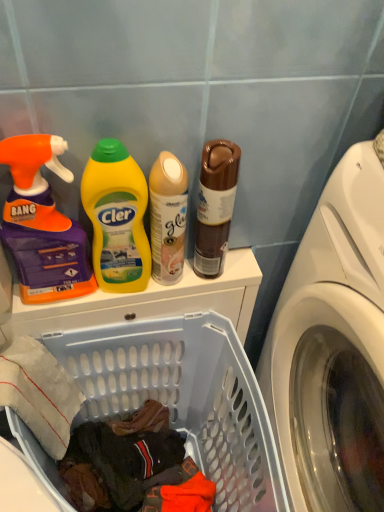
What do you see at coordinates (184, 396) in the screenshot?
I see `translucent plastic laundry basket at lower left` at bounding box center [184, 396].

This screenshot has width=384, height=512. Describe the element at coordinates (168, 217) in the screenshot. I see `matte beige spray can at center, placed as the 3th cleaning product when sorted from left to right` at that location.

Describe the element at coordinates (333, 347) in the screenshot. I see `white glossy washing machine at right` at that location.

Where is `white glossy washing machine at right`? This screenshot has width=384, height=512. white glossy washing machine at right is located at coordinates (333, 347).

How much space does orange matte spray bottle at left, the first cleaning product in the left-to-right sequence, occupy vertically?

It is 10.46 inches.

Where is `orange matte spray bottle at left, the first cleaning product in the left-to-right sequence`? Image resolution: width=384 pixels, height=512 pixels. orange matte spray bottle at left, the first cleaning product in the left-to-right sequence is located at coordinates 42,224.

In order to face yellow plastic bottle at center, acting as the 2th cleaning product starting from the right, should I rotate leftwards or rightwards?

Rotate left and turn 10.042 degrees.

Identify the location of yellow plastic bottle at center, which appears as the 2th cleaning product when viewed from the left. (117, 217).

Locate an element on the screen. translucent plastic laundry basket at lower left is located at coordinates (184, 396).

Is orange matte spray bottle at left, the 3th cleaning product viewed from the right, spatially inside matte beige spray can at center, acting as the 1th cleaning product starting from the right, or outside of it?

orange matte spray bottle at left, the 3th cleaning product viewed from the right, lies outside matte beige spray can at center, acting as the 1th cleaning product starting from the right.

From the image's perspective, is orange matte spray bottle at left, the 3th cleaning product viewed from the right, under matte beige spray can at center, placed as the 3th cleaning product when sorted from left to right?

Correct, orange matte spray bottle at left, the 3th cleaning product viewed from the right, appears lower than matte beige spray can at center, placed as the 3th cleaning product when sorted from left to right, in the image.

From a real-world perspective, is orange matte spray bottle at left, the 3th cleaning product viewed from the right, physically above matte beige spray can at center, placed as the 3th cleaning product when sorted from left to right?

Yes, from a real-world perspective, orange matte spray bottle at left, the 3th cleaning product viewed from the right, is above matte beige spray can at center, placed as the 3th cleaning product when sorted from left to right.

Is orange matte spray bottle at left, the 3th cleaning product viewed from the right, touching matte beige spray can at center, placed as the 3th cleaning product when sorted from left to right?

No, orange matte spray bottle at left, the 3th cleaning product viewed from the right, is not in contact with matte beige spray can at center, placed as the 3th cleaning product when sorted from left to right.

How distant is yellow plastic bottle at center, which appears as the 2th cleaning product when viewed from the left, from matte beige spray can at center, placed as the 3th cleaning product when sorted from left to right?

The distance of yellow plastic bottle at center, which appears as the 2th cleaning product when viewed from the left, from matte beige spray can at center, placed as the 3th cleaning product when sorted from left to right, is 1.91 inches.

Is yellow plastic bottle at center, acting as the 2th cleaning product starting from the right, inside the boundaries of matte beige spray can at center, placed as the 3th cleaning product when sorted from left to right, or outside?

yellow plastic bottle at center, acting as the 2th cleaning product starting from the right, is outside matte beige spray can at center, placed as the 3th cleaning product when sorted from left to right.

Considering the relative sizes of yellow plastic bottle at center, acting as the 2th cleaning product starting from the right, and matte beige spray can at center, acting as the 1th cleaning product starting from the right, in the image provided, is yellow plastic bottle at center, acting as the 2th cleaning product starting from the right, thinner than matte beige spray can at center, acting as the 1th cleaning product starting from the right,?

Yes.

Which of these two, yellow plastic bottle at center, which appears as the 2th cleaning product when viewed from the left, or matte beige spray can at center, acting as the 1th cleaning product starting from the right, stands shorter?

Standing shorter between the two is matte beige spray can at center, acting as the 1th cleaning product starting from the right.

Is matte beige spray can at center, acting as the 1th cleaning product starting from the right, oriented away from white glossy washing machine at right?

No, white glossy washing machine at right is not at the back of matte beige spray can at center, acting as the 1th cleaning product starting from the right.

Can you confirm if matte beige spray can at center, acting as the 1th cleaning product starting from the right, is thinner than white glossy washing machine at right?

Indeed, matte beige spray can at center, acting as the 1th cleaning product starting from the right, has a lesser width compared to white glossy washing machine at right.

In the image, is matte beige spray can at center, acting as the 1th cleaning product starting from the right, positioned in front of or behind white glossy washing machine at right?

matte beige spray can at center, acting as the 1th cleaning product starting from the right, is behind white glossy washing machine at right.

Can you tell me how much orange matte spray bottle at left, the first cleaning product in the left-to-right sequence, and brown matte can at upper center differ in facing direction?

They differ by 1.91 degrees in their facing directions.

Is orange matte spray bottle at left, the first cleaning product in the left-to-right sequence, spatially inside brown matte can at upper center, or outside of it?

orange matte spray bottle at left, the first cleaning product in the left-to-right sequence, exists outside the volume of brown matte can at upper center.

Is point (30, 135) positioned before point (203, 192)?

Yes, it is in front of point (203, 192).

From a real-world perspective, count 2nd cleaning products upward from the brown matte can at upper center and point to it. Please provide its 2D coordinates.

[(42, 224)]

What's the angular difference between translucent plastic laundry basket at lower left and white glossy washing machine at right's facing directions?

They differ by 86.3 degrees in their facing directions.

Looking at this image, can you confirm if translucent plastic laundry basket at lower left is shorter than white glossy washing machine at right?

Yes.

Looking at their sizes, would you say translucent plastic laundry basket at lower left is wider or thinner than white glossy washing machine at right?

In the image, translucent plastic laundry basket at lower left appears to be more narrow than white glossy washing machine at right.

Is translucent plastic laundry basket at lower left facing away from white glossy washing machine at right?

translucent plastic laundry basket at lower left does not have its back to white glossy washing machine at right.

The width and height of the screenshot is (384, 512). Find the location of `cleaning product that is the 1st object located behind the white glossy washing machine at right`. cleaning product that is the 1st object located behind the white glossy washing machine at right is located at coordinates (42, 224).

Relative to orange matte spray bottle at left, the first cleaning product in the left-to-right sequence, is white glossy washing machine at right in front or behind?

In the image, white glossy washing machine at right appears in front of orange matte spray bottle at left, the first cleaning product in the left-to-right sequence.

Is point (356, 422) more distant than point (16, 188)?

Yes, point (356, 422) is behind point (16, 188).

From a real-world perspective, is white glossy washing machine at right positioned over orange matte spray bottle at left, the first cleaning product in the left-to-right sequence, based on gravity?

No, from a real-world perspective, white glossy washing machine at right is not above orange matte spray bottle at left, the first cleaning product in the left-to-right sequence.

From a real-world perspective, is brown matte can at upper center physically below translucent plastic laundry basket at lower left?

No, from a real-world perspective, brown matte can at upper center is not below translucent plastic laundry basket at lower left.

Which is closer to the camera, (216, 205) or (135, 367)?

Positioned in front is point (216, 205).

Is the depth of brown matte can at upper center less than that of translucent plastic laundry basket at lower left?

No.

Would you consider brown matte can at upper center to be distant from translucent plastic laundry basket at lower left?

That's not correct — brown matte can at upper center is a little close to translucent plastic laundry basket at lower left.

Which cleaning product is the 2nd one when counting from the right side of the orange matte spray bottle at left, the 3th cleaning product viewed from the right? Please provide its 2D coordinates.

[(168, 217)]

The height and width of the screenshot is (512, 384). I want to click on the 1st cleaning product in front when counting from the matte beige spray can at center, acting as the 1th cleaning product starting from the right, so (x=117, y=217).

Looking at the image, which one is located closer to matte beige spray can at center, acting as the 1th cleaning product starting from the right, orange matte spray bottle at left, the 3th cleaning product viewed from the right, or brown matte can at upper center?

brown matte can at upper center lies closer to matte beige spray can at center, acting as the 1th cleaning product starting from the right, than the other object.

Considering their positions, is matte beige spray can at center, acting as the 1th cleaning product starting from the right, positioned further to white glossy washing machine at right than brown matte can at upper center?

The object further to white glossy washing machine at right is matte beige spray can at center, acting as the 1th cleaning product starting from the right.

Considering their positions, is matte beige spray can at center, placed as the 3th cleaning product when sorted from left to right, positioned closer to orange matte spray bottle at left, the first cleaning product in the left-to-right sequence, than white glossy washing machine at right?

Based on the image, matte beige spray can at center, placed as the 3th cleaning product when sorted from left to right, appears to be nearer to orange matte spray bottle at left, the first cleaning product in the left-to-right sequence.

Looking at the image, which one is located further to white glossy washing machine at right, translucent plastic laundry basket at lower left or orange matte spray bottle at left, the 3th cleaning product viewed from the right?

Among the two, orange matte spray bottle at left, the 3th cleaning product viewed from the right, is located further to white glossy washing machine at right.

When comparing their distances from orange matte spray bottle at left, the 3th cleaning product viewed from the right, does yellow plastic bottle at center, acting as the 2th cleaning product starting from the right, or translucent plastic laundry basket at lower left seem closer?

yellow plastic bottle at center, acting as the 2th cleaning product starting from the right, is closer to orange matte spray bottle at left, the 3th cleaning product viewed from the right.

Looking at the image, which one is located closer to translucent plastic laundry basket at lower left, brown matte can at upper center or yellow plastic bottle at center, acting as the 2th cleaning product starting from the right?

Among the two, yellow plastic bottle at center, acting as the 2th cleaning product starting from the right, is located nearer to translucent plastic laundry basket at lower left.

From the image, which object appears to be nearer to brown matte can at upper center, matte beige spray can at center, acting as the 1th cleaning product starting from the right, or white glossy washing machine at right?

Based on the image, matte beige spray can at center, acting as the 1th cleaning product starting from the right, appears to be nearer to brown matte can at upper center.

From the image, which object appears to be farther from white glossy washing machine at right, orange matte spray bottle at left, the first cleaning product in the left-to-right sequence, or translucent plastic laundry basket at lower left?

orange matte spray bottle at left, the first cleaning product in the left-to-right sequence, is further to white glossy washing machine at right.

The width and height of the screenshot is (384, 512). Find the location of `bottle between yellow plastic bottle at center, which appears as the 2th cleaning product when viewed from the left, and translucent plastic laundry basket at lower left in the up-down direction`. bottle between yellow plastic bottle at center, which appears as the 2th cleaning product when viewed from the left, and translucent plastic laundry basket at lower left in the up-down direction is located at coordinates [215, 205].

Find the location of a particular element. This screenshot has height=512, width=384. bottle located between matte beige spray can at center, acting as the 1th cleaning product starting from the right, and white glossy washing machine at right in the left-right direction is located at coordinates (215, 205).

Locate an element on the screen. The width and height of the screenshot is (384, 512). cleaning product between matte beige spray can at center, placed as the 3th cleaning product when sorted from left to right, and translucent plastic laundry basket at lower left from top to bottom is located at coordinates (42, 224).

Locate an element on the screen. The height and width of the screenshot is (512, 384). laundry basket between yellow plastic bottle at center, acting as the 2th cleaning product starting from the right, and white glossy washing machine at right from left to right is located at coordinates (184, 396).